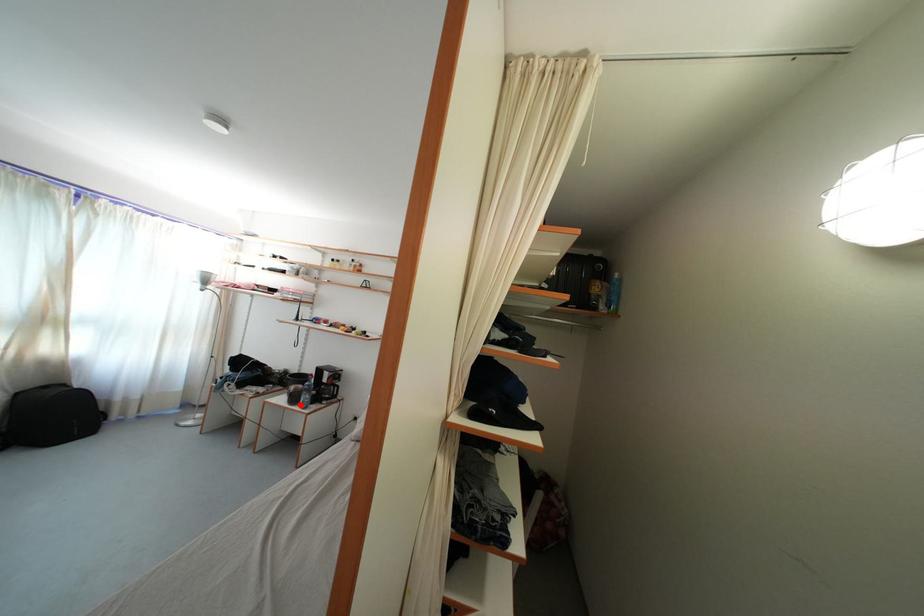
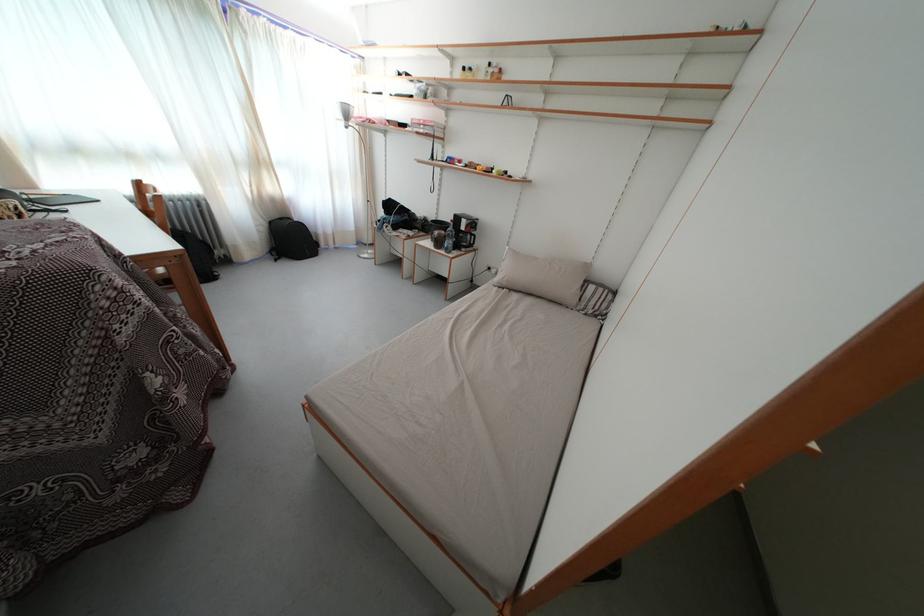
Find the pixel in the second image that matches the highlighted location in the first image.

(444, 249)